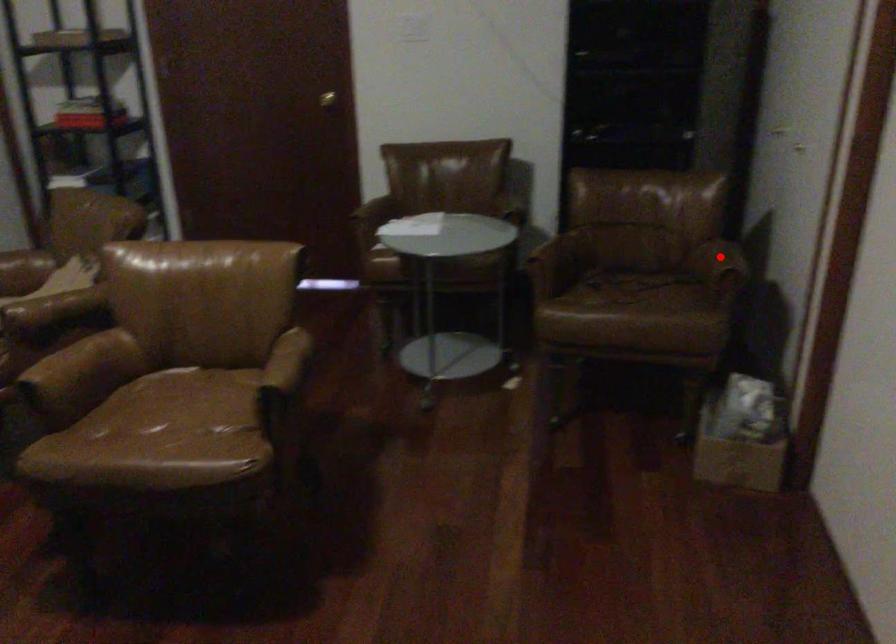
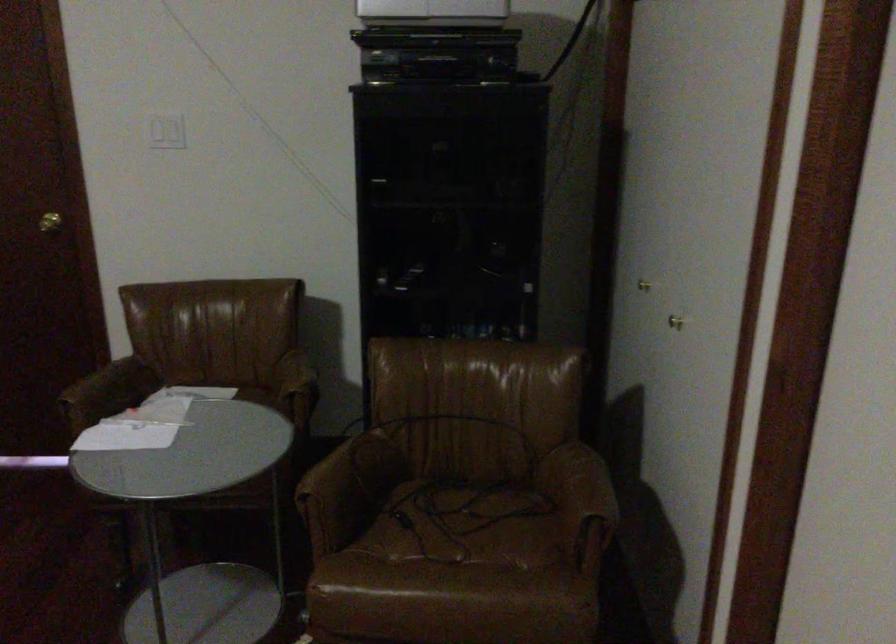
Where in the second image is the point corresponding to the highlighted location from the first image?

(582, 485)